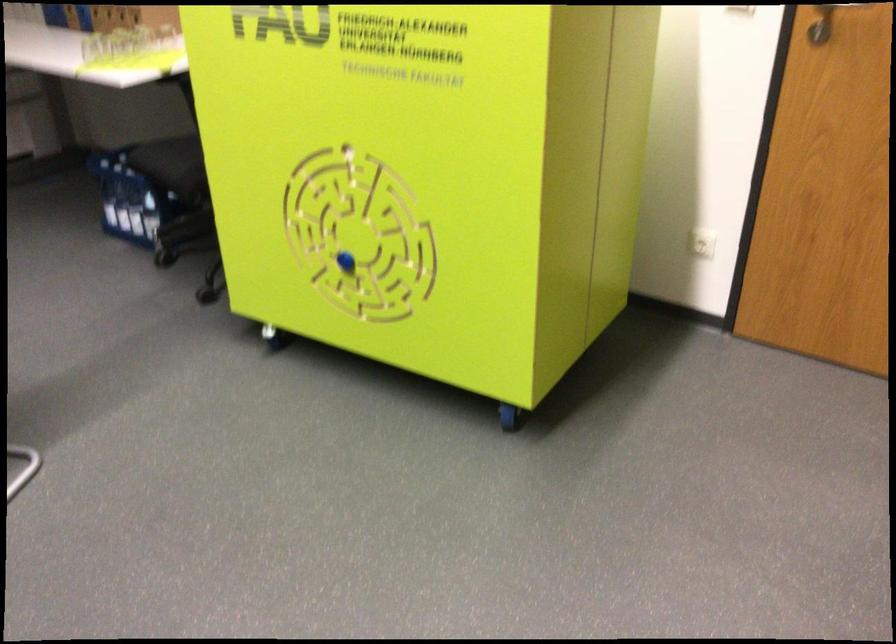
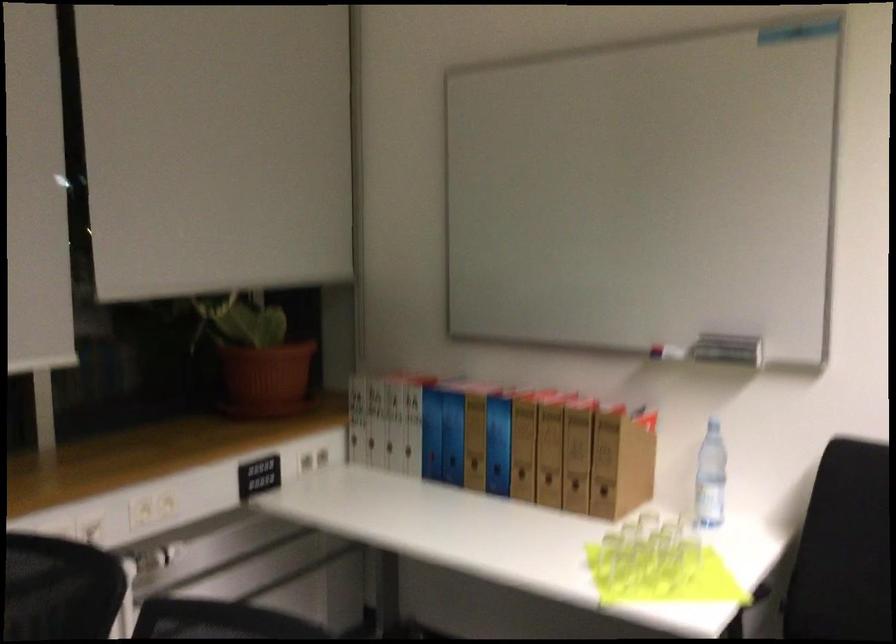
What movement of the cameraman would produce the second image?

The cameraman walked toward left, forward.